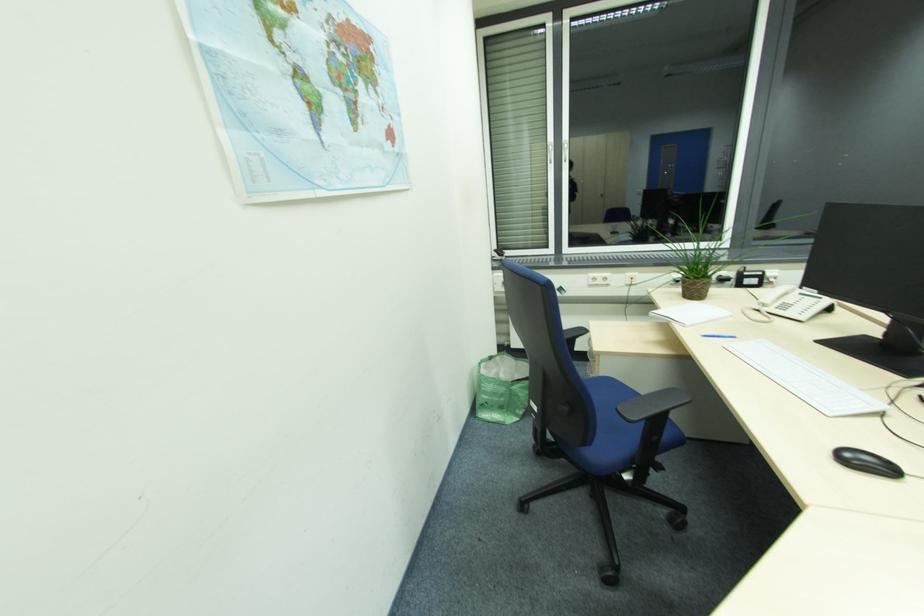
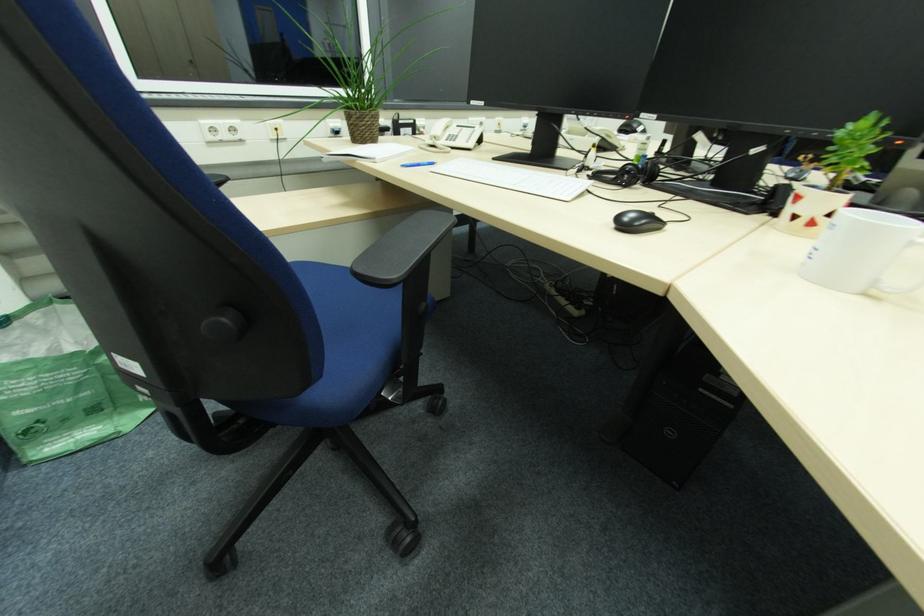
The images are taken continuously from a first-person perspective. In which direction is your viewpoint rotating?

The camera's rotation is toward right-down.